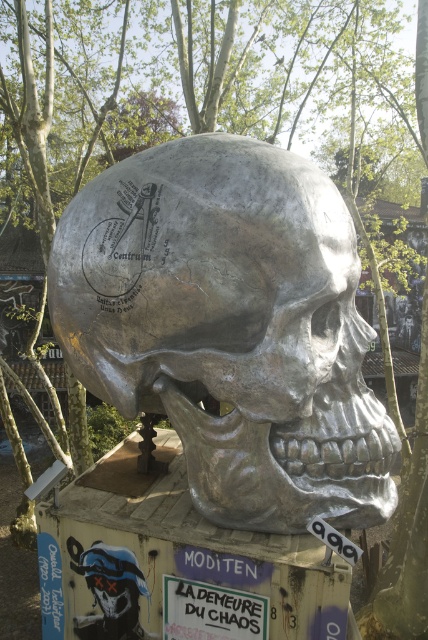
Can you confirm if shiny silver skull at center is smaller than blue glossy skull at lower left?

Incorrect, shiny silver skull at center is not smaller in size than blue glossy skull at lower left.

Describe the element at coordinates (229, 326) in the screenshot. I see `shiny silver skull at center` at that location.

What are the coordinates of `shiny silver skull at center` in the screenshot? It's located at (229, 326).